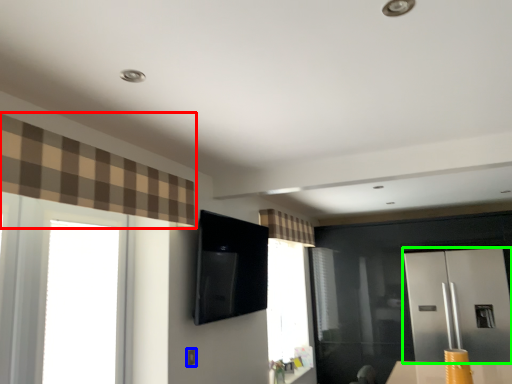
Question: Which object is positioned farthest from curtain (highlighted by a red box)? Select from electric outlet (highlighted by a blue box) and screen door (highlighted by a green box).

Choices:
 (A) electric outlet
 (B) screen door

Answer: (B)